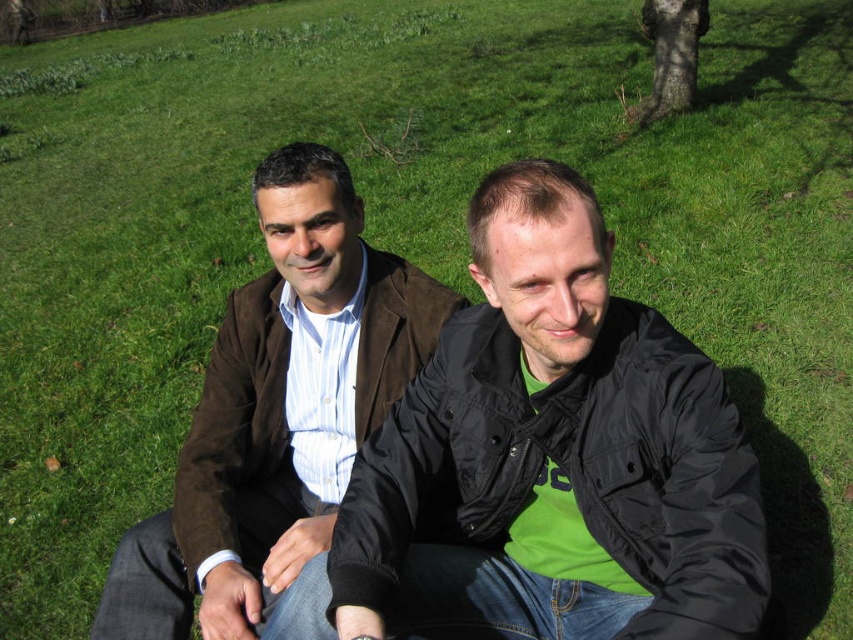
Question: Which point is closer to the camera taking this photo?

Choices:
 (A) (318, 244)
 (B) (656, 552)

Answer: (B)

Question: Does matte black jacket at center have a greater width compared to brown suede jacket at center?

Choices:
 (A) no
 (B) yes

Answer: (A)

Question: Which point is farther to the camera?

Choices:
 (A) (137, 564)
 (B) (685, 348)

Answer: (A)

Question: Does matte black jacket at center have a greater width compared to brown suede jacket at center?

Choices:
 (A) no
 (B) yes

Answer: (A)

Question: Is matte black jacket at center in front of brown suede jacket at center?

Choices:
 (A) yes
 (B) no

Answer: (A)